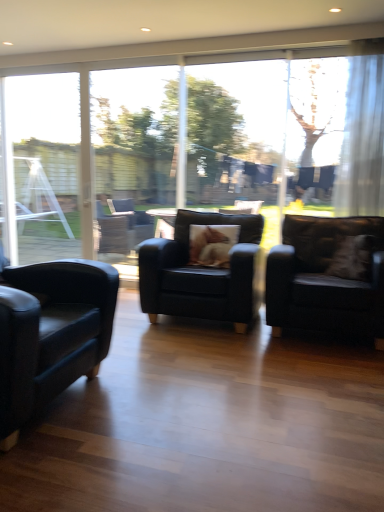
Question: Is matte black armchair at right, which is the 3th chair from left to right, turned away from brown furry pillow at center?

Choices:
 (A) no
 (B) yes

Answer: (A)

Question: From a real-world perspective, is matte black armchair at right, the 1th chair in the right-to-left sequence, under brown furry pillow at center?

Choices:
 (A) yes
 (B) no

Answer: (A)

Question: From a real-world perspective, is matte black armchair at right, the 1th chair in the right-to-left sequence, physically above brown furry pillow at center?

Choices:
 (A) yes
 (B) no

Answer: (B)

Question: Does matte black armchair at right, which is the 3th chair from left to right, have a smaller size compared to brown furry pillow at center?

Choices:
 (A) no
 (B) yes

Answer: (A)

Question: Does matte black armchair at right, which is the 3th chair from left to right, have a greater width compared to brown furry pillow at center?

Choices:
 (A) no
 (B) yes

Answer: (B)

Question: Is matte black armchair at right, the 1th chair in the right-to-left sequence, outside of brown furry pillow at center?

Choices:
 (A) no
 (B) yes

Answer: (B)

Question: Can clear glass window frame at left be found inside white sheer curtain at upper right?

Choices:
 (A) yes
 (B) no

Answer: (B)

Question: Is white sheer curtain at upper right positioned with its back to clear glass window frame at left?

Choices:
 (A) no
 (B) yes

Answer: (A)

Question: Does white sheer curtain at upper right come behind clear glass window frame at left?

Choices:
 (A) no
 (B) yes

Answer: (A)

Question: Does white sheer curtain at upper right lie in front of clear glass window frame at left?

Choices:
 (A) yes
 (B) no

Answer: (A)

Question: Are white sheer curtain at upper right and clear glass window frame at left beside each other?

Choices:
 (A) no
 (B) yes

Answer: (A)

Question: From the image's perspective, is white sheer curtain at upper right above clear glass window frame at left?

Choices:
 (A) no
 (B) yes

Answer: (B)

Question: Can you confirm if brown furry pillow at center is wider than transparent glass screen door at center?

Choices:
 (A) no
 (B) yes

Answer: (B)